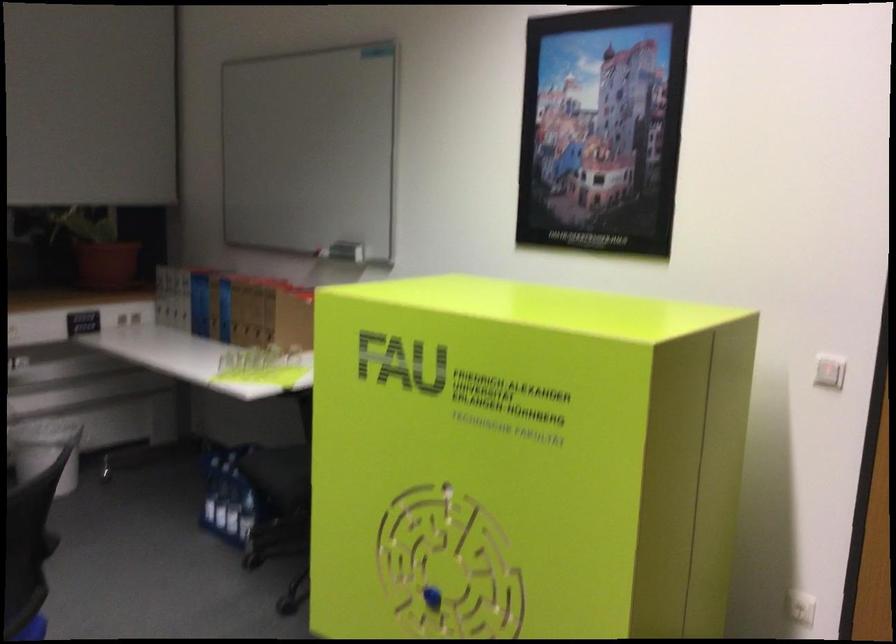
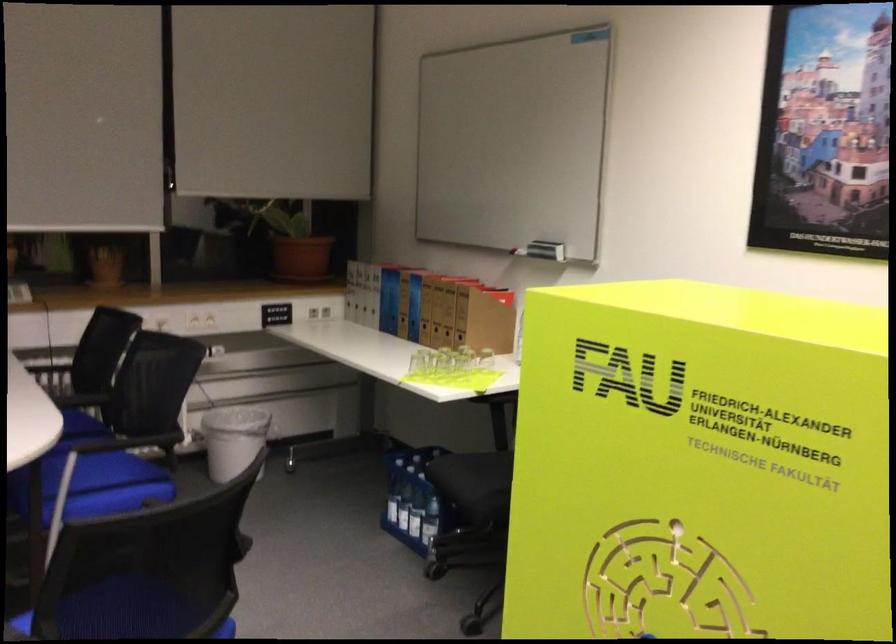
In the second image, find the point that corresponds to point 235,507 in the first image.

(416, 514)